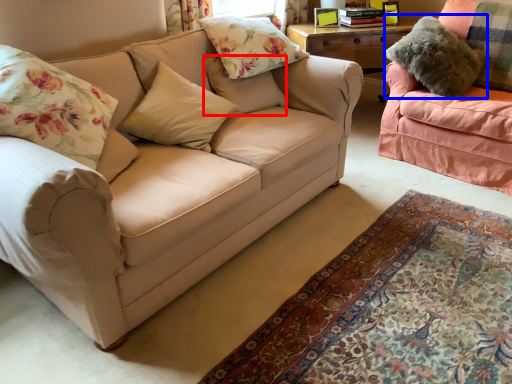
Question: Which object is closer to the camera taking this photo, pillow (highlighted by a red box) or pillow (highlighted by a blue box)?

Choices:
 (A) pillow
 (B) pillow

Answer: (A)